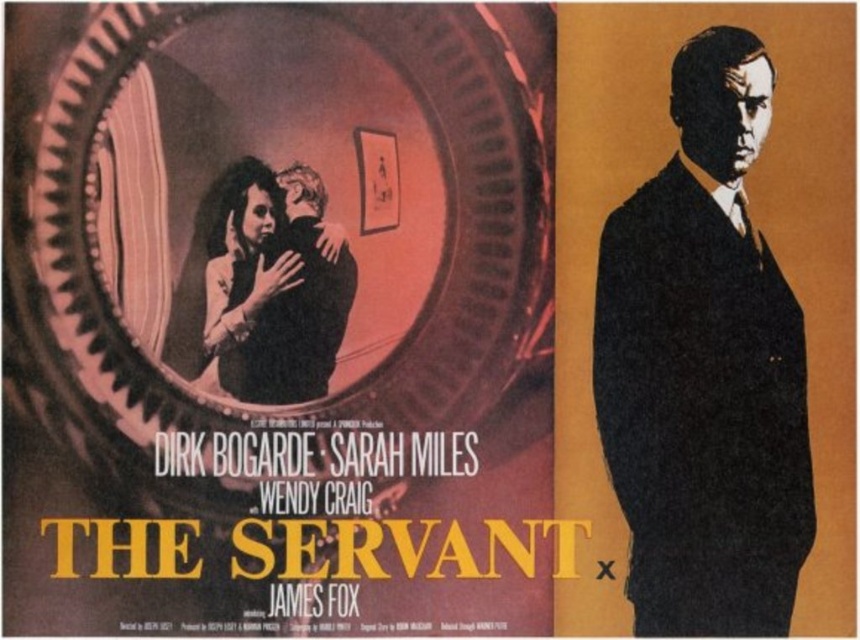
You are standing in front of the vintage movie poster for The Servant. There is a point marked at coordinates point (617, 496). Can you determine if this point is closer to you or farther away compared to the circular frame on the left side?

The point (617, 496) is 8.85 feet from the viewer. Since the circular frame on the left is part of the poster itself, which is presumably at the same distance as the poster, the point is likely part of the poster and thus at the same distance. However, without specific information about the circular frame, we can only state the point is 8.85 feet away.

Looking at the vintage movie poster for The Servant, which object occupies more vertical space between the matte black suit at right and the black paper at center?

The matte black suit at right is much taller than the black paper at center, so it occupies more vertical space.

You are a film historian analyzing the poster. You need to place a label indicating the title of the film between the matte black suit at right and the black paper at center. Given that the label requires 20 inches of space, will there be enough room?

The distance between the matte black suit at right and the black paper at center is 19.92 inches, which is slightly less than the required 20 inches. Therefore, there isn